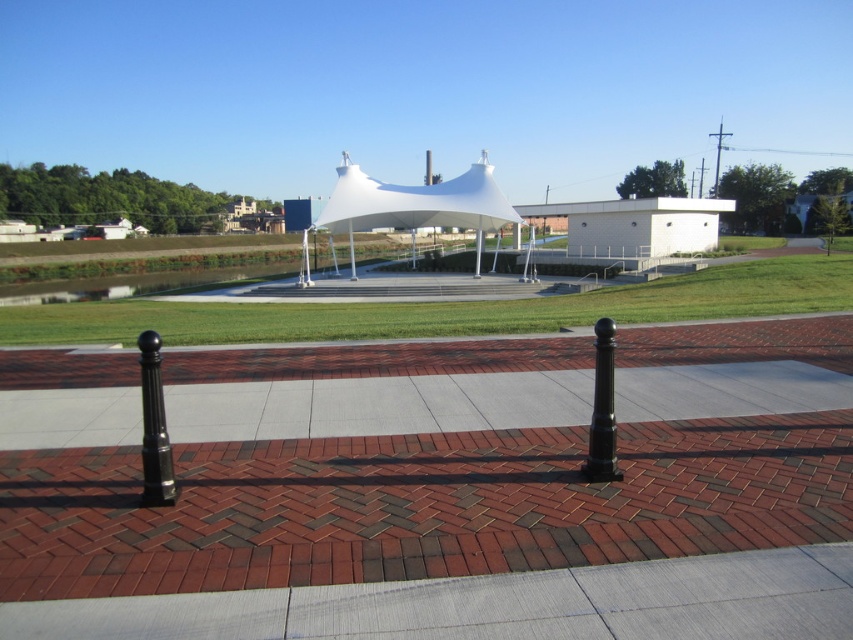
Question: Which point is farther to the camera?

Choices:
 (A) (457, 218)
 (B) (151, 474)
 (C) (579, 596)
 (D) (607, 406)

Answer: (A)

Question: Is gray concrete pavement at center above black polished post at center?

Choices:
 (A) yes
 (B) no

Answer: (B)

Question: Estimate the real-world distances between objects in this image. Which object is closer to the black polished metal post at left?

Choices:
 (A) black polished post at center
 (B) white fabric tent at center

Answer: (A)

Question: Which of the following is the closest to the observer?

Choices:
 (A) black polished metal post at left
 (B) white fabric tent at center
 (C) black polished post at center

Answer: (A)

Question: Is white fabric tent at center to the right of black polished metal post at left from the viewer's perspective?

Choices:
 (A) yes
 (B) no

Answer: (B)

Question: Considering the relative positions of white fabric tent at center and black polished post at center in the image provided, where is white fabric tent at center located with respect to black polished post at center?

Choices:
 (A) left
 (B) right

Answer: (A)